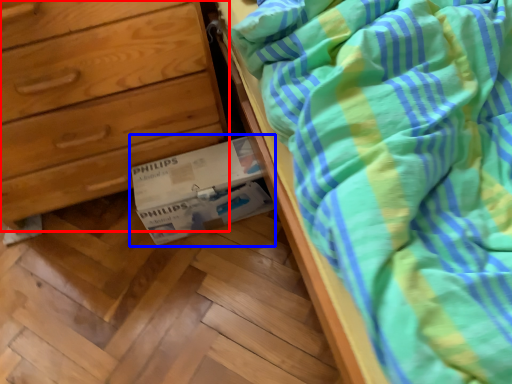
Question: Among these objects, which one is nearest to the camera, chest of drawers (highlighted by a red box) or cardboard box (highlighted by a blue box)?

Choices:
 (A) chest of drawers
 (B) cardboard box

Answer: (A)